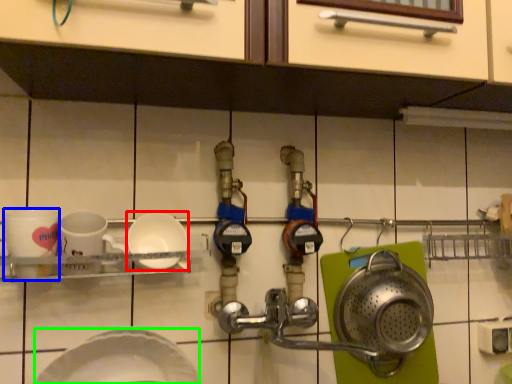
Question: Estimate the real-world distances between objects in this image. Which object is farther from plate (highlighted by a red box), coffee cup (highlighted by a blue box) or plate (highlighted by a green box)?

Choices:
 (A) coffee cup
 (B) plate

Answer: (B)